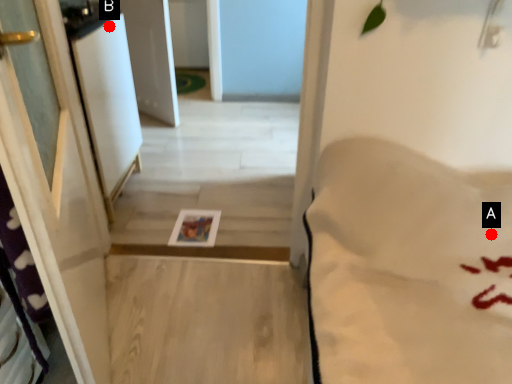
Question: Two points are circled on the image, labeled by A and B beside each circle. Which point is closer to the camera taking this photo?

Choices:
 (A) A is closer
 (B) B is closer

Answer: (A)